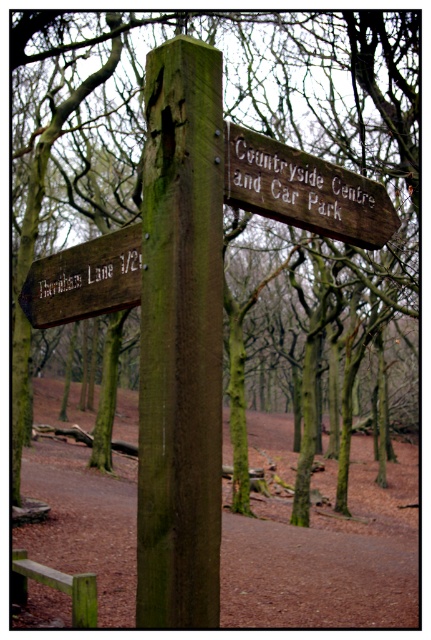
Which of these two, wooden sign at left or green rough wooden bench at lower left, stands shorter?

With less height is wooden sign at left.

Can you confirm if wooden sign at left is positioned below green rough wooden bench at lower left?

No.

Does point (34, 284) come farther from viewer compared to point (71, 618)?

No, (34, 284) is in front of (71, 618).

Find the location of a particular element. This screenshot has height=640, width=431. wooden sign at left is located at coordinates (84, 280).

This screenshot has height=640, width=431. In order to click on green rough wood post at center in this screenshot , I will do `click(181, 339)`.

From the picture: Who is more forward, (143,349) or (83,308)?

Point (143,349) is more forward.

Find the location of a particular element. This screenshot has height=640, width=431. green rough wood post at center is located at coordinates (181, 339).

Which is in front, point (105, 300) or point (22, 593)?

Point (105, 300) is more forward.

Is point (91, 246) farther from viewer compared to point (84, 580)?

No, (91, 246) is closer to viewer.

Where is `dark brown wood signpost at left`? Image resolution: width=431 pixels, height=640 pixels. dark brown wood signpost at left is located at coordinates (90, 275).